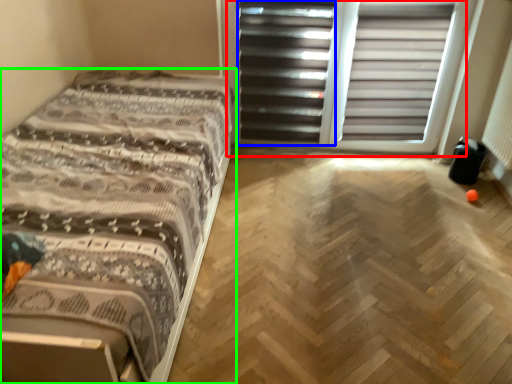
Question: Estimate the real-world distances between objects in this image. Which object is farther from screen door (highlighted by a red box), screen door (highlighted by a blue box) or bed (highlighted by a green box)?

Choices:
 (A) screen door
 (B) bed

Answer: (B)